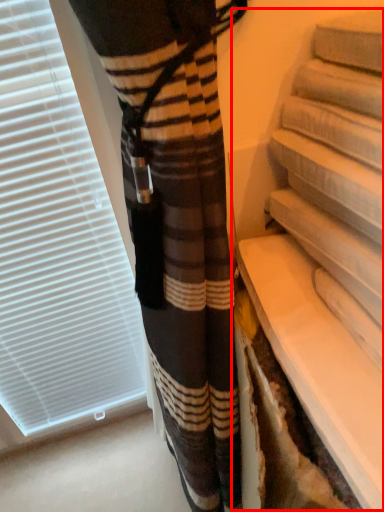
Question: From the image's perspective, what is the correct spatial positioning of shelf (annotated by the red box) in reference to window blind?

Choices:
 (A) above
 (B) below

Answer: (B)